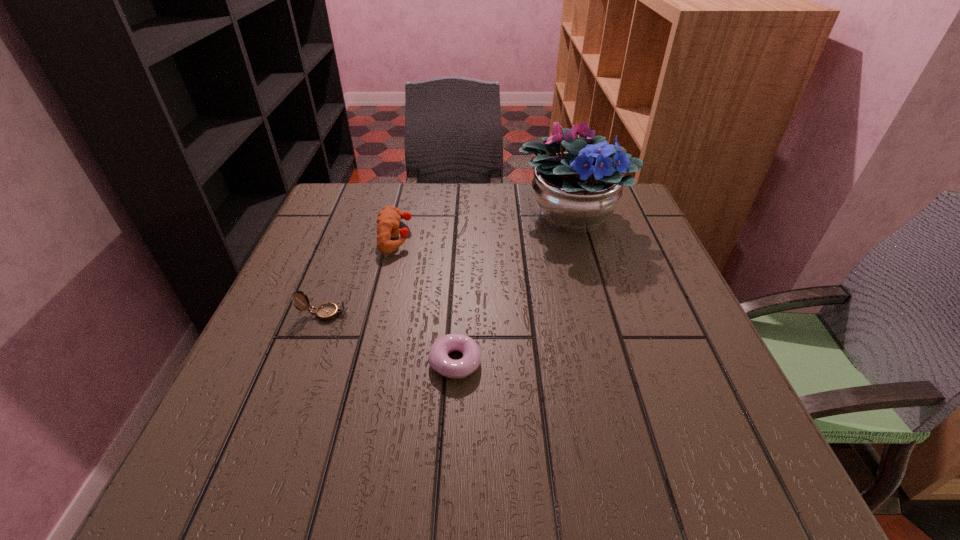
Locate an element on the screen. the rightmost object is located at coordinates (576, 191).

Where is `the tallest object`? the tallest object is located at coordinates (576, 191).

The height and width of the screenshot is (540, 960). In order to click on the third shortest object in this screenshot , I will do `click(388, 219)`.

The image size is (960, 540). Find the location of `the second object from left to right`. the second object from left to right is located at coordinates (388, 219).

You are a GUI agent. You are given a task and a screenshot of the screen. Output one action in this format:
    pyautogui.click(x=<x>, y=<y>)
    Task: Click on the leftmost object
    The height and width of the screenshot is (540, 960).
    Given the screenshot: What is the action you would take?
    pyautogui.click(x=327, y=311)

This screenshot has width=960, height=540. Find the location of `the third tallest object`. the third tallest object is located at coordinates (327, 311).

The width and height of the screenshot is (960, 540). In order to click on the nearest object in this screenshot , I will do point(439,360).

Where is `the shortest object`? The image size is (960, 540). the shortest object is located at coordinates (439, 360).

Locate an element on the screen. Image resolution: width=960 pixels, height=540 pixels. free space located on the left of the rightmost object is located at coordinates (486, 213).

This screenshot has height=540, width=960. Identify the location of vacant position located 0.360m with the gloves of the second object from left to right facing forward. (561, 237).